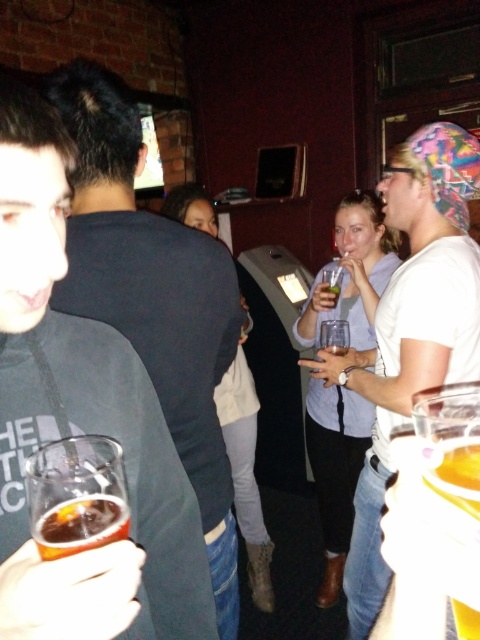
Based on the photo, does matte blue shirt at center have a lesser width compared to translucent amber liquid at lower left?

Incorrect, matte blue shirt at center's width is not less than translucent amber liquid at lower left's.

Can you confirm if matte blue shirt at center is smaller than translucent amber liquid at lower left?

No.

What are the coordinates of `matte blue shirt at center` in the screenshot? It's located at (336, 470).

Identify the location of matte blue shirt at center. Image resolution: width=480 pixels, height=640 pixels. (336, 470).

Can you confirm if white cotton t-shirt at upper right is positioned to the left of light blue denim jeans at center?

No, white cotton t-shirt at upper right is not to the left of light blue denim jeans at center.

Is white cotton t-shirt at upper right in front of light blue denim jeans at center?

That is True.

The image size is (480, 640). What are the coordinates of `white cotton t-shirt at upper right` in the screenshot? It's located at (410, 328).

The width and height of the screenshot is (480, 640). I want to click on white cotton t-shirt at upper right, so click(x=410, y=328).

Does white cotton t-shirt at upper right have a larger size compared to translucent amber liquid at lower left?

Indeed, white cotton t-shirt at upper right has a larger size compared to translucent amber liquid at lower left.

Is white cotton t-shirt at upper right taller than translucent amber liquid at lower left?

Yes, white cotton t-shirt at upper right is taller than translucent amber liquid at lower left.

You are a GUI agent. You are given a task and a screenshot of the screen. Output one action in this format:
    pyautogui.click(x=<x>, y=<y>)
    Task: Click on the white cotton t-shirt at upper right
    
    Given the screenshot: What is the action you would take?
    pyautogui.click(x=410, y=328)

The image size is (480, 640). I want to click on white cotton t-shirt at upper right, so click(410, 328).